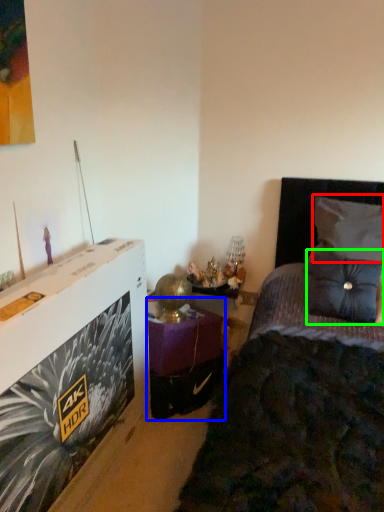
Question: Considering the real-world distances, which object is closest to pillow (highlighted by a red box)? table (highlighted by a blue box) or pillow (highlighted by a green box).

Choices:
 (A) table
 (B) pillow

Answer: (B)